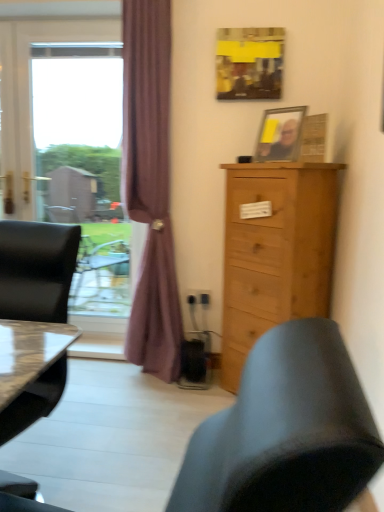
Where is `free point above transparent glass window at left (from a real-world perspective)`? The height and width of the screenshot is (512, 384). free point above transparent glass window at left (from a real-world perspective) is located at coordinates (72, 47).